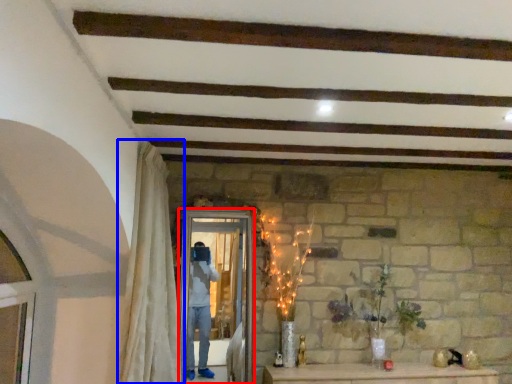
Question: Among these objects, which one is nearest to the camera, screen door (highlighted by a red box) or curtain (highlighted by a blue box)?

Choices:
 (A) screen door
 (B) curtain

Answer: (B)